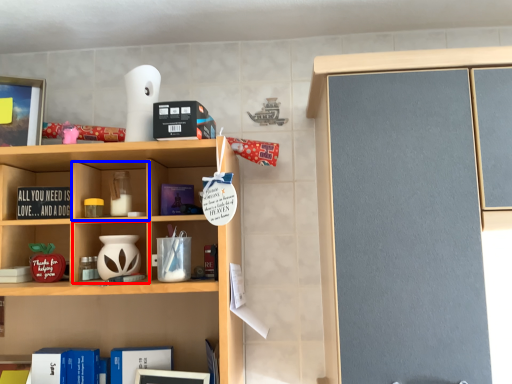
Question: Which point is closer to the camera, cabinet (highlighted by a red box) or cabinet (highlighted by a blue box)?

Choices:
 (A) cabinet
 (B) cabinet

Answer: (A)